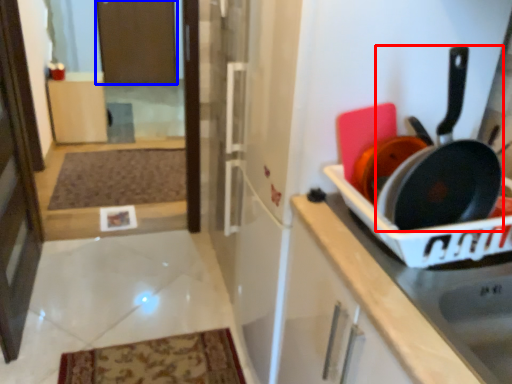
Question: Which object appears closest to the camera in this image, frying pan (highlighted by a red box) or screen door (highlighted by a blue box)?

Choices:
 (A) frying pan
 (B) screen door

Answer: (A)